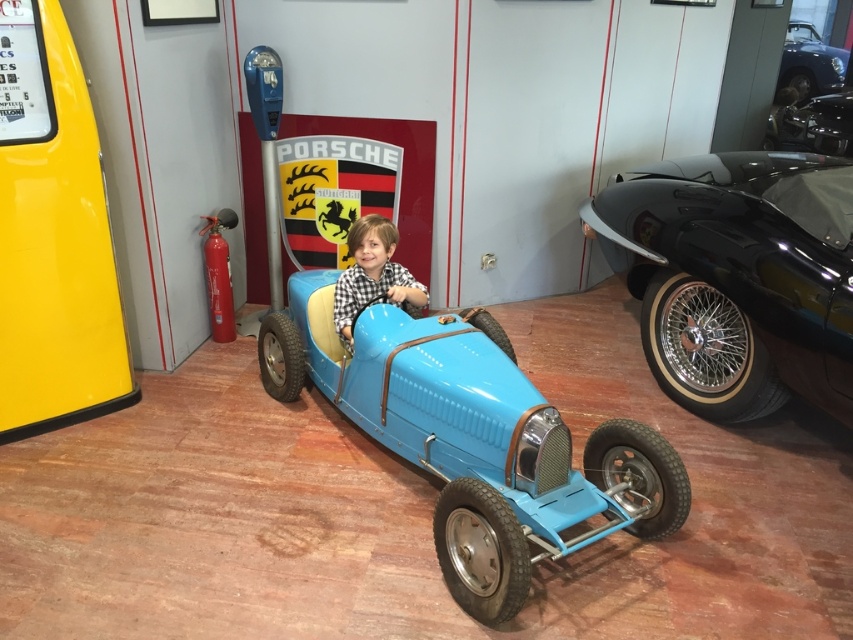
Question: Is matte blue car at center above shiny chrome engine at center?

Choices:
 (A) yes
 (B) no

Answer: (B)

Question: Does shiny black car at right have a larger size compared to shiny chrome engine at center?

Choices:
 (A) no
 (B) yes

Answer: (B)

Question: Which object appears farthest from the camera in this image?

Choices:
 (A) shiny black car at upper right
 (B) matte blue car at center

Answer: (A)

Question: Is shiny black car at right to the left of shiny black car at upper right from the viewer's perspective?

Choices:
 (A) no
 (B) yes

Answer: (B)

Question: Which object appears closest to the camera in this image?

Choices:
 (A) shiny black car at upper right
 (B) matte blue toy car at center

Answer: (B)

Question: Which point is farther to the camera?

Choices:
 (A) matte blue toy car at center
 (B) shiny black car at upper right
 (C) shiny chrome engine at center

Answer: (B)